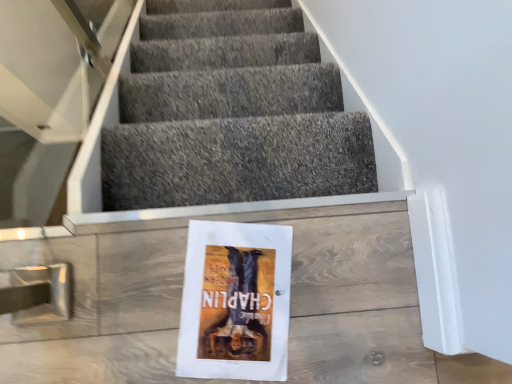
You are a GUI agent. You are given a task and a screenshot of the screen. Output one action in this format:
    pyautogui.click(x=<x>, y=<y>)
    Task: Click on the white paper poster at lower center
    
    Given the screenshot: What is the action you would take?
    pyautogui.click(x=234, y=301)

What do you see at coordinates (234, 301) in the screenshot? I see `white paper poster at lower center` at bounding box center [234, 301].

This screenshot has height=384, width=512. Find the location of `white paper poster at lower center`. white paper poster at lower center is located at coordinates (234, 301).